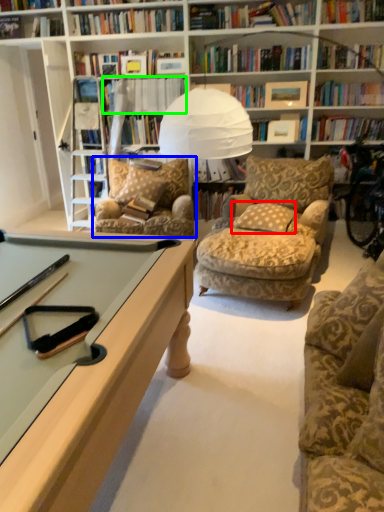
Question: Based on their relative distances, which object is nearer to pillow (highlighted by a red box)? Choose from chair (highlighted by a blue box) and book (highlighted by a green box).

Choices:
 (A) chair
 (B) book

Answer: (A)